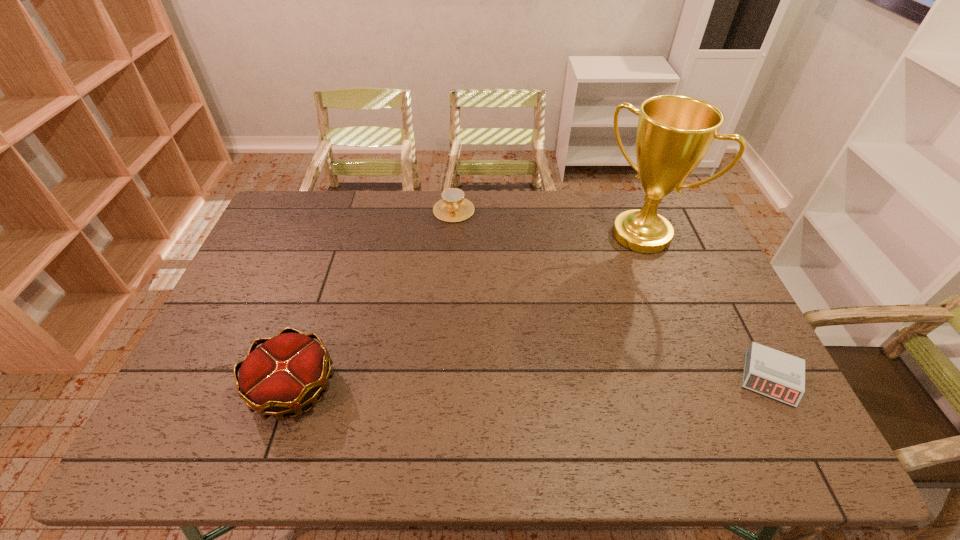
Where is `object that is at the far right corner`? The width and height of the screenshot is (960, 540). object that is at the far right corner is located at coordinates (674, 133).

You are a GUI agent. You are given a task and a screenshot of the screen. Output one action in this format:
    pyautogui.click(x=<x>, y=<y>)
    Task: Click on the object situated at the near right corner
    
    Given the screenshot: What is the action you would take?
    pyautogui.click(x=778, y=375)

Find the location of a particular element. This screenshot has width=960, height=540. blank space at the far edge is located at coordinates pos(618,203).

Identify the location of vacant region at the near edge of the desktop. The height and width of the screenshot is (540, 960). (492, 401).

In order to click on vacant space at the left edge in this screenshot , I will do `click(215, 334)`.

Identify the location of free space at the right edge of the desktop. (732, 372).

Locate an element on the screen. The height and width of the screenshot is (540, 960). free space between the award and the crown is located at coordinates (468, 311).

Locate an element on the screen. This screenshot has width=960, height=540. blank region between the leftmost object and the third object from right to left is located at coordinates (373, 299).

You are a GUI agent. You are given a task and a screenshot of the screen. Output one action in this format:
    pyautogui.click(x=<x>, y=<y>)
    Task: Click on the vacant region between the tallest object and the third object from right to left
    The width and height of the screenshot is (960, 540).
    Given the screenshot: What is the action you would take?
    pyautogui.click(x=547, y=222)

Locate an element on the screen. This screenshot has width=960, height=540. vacant point located between the third shortest object and the award is located at coordinates (468, 311).